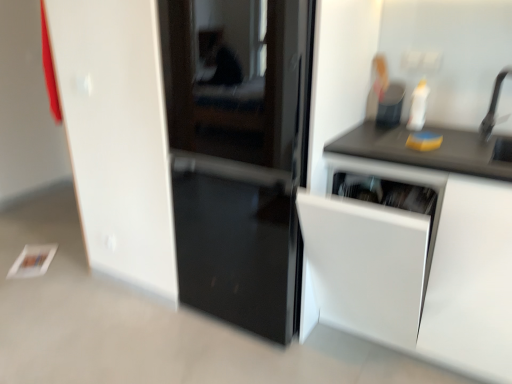
Question: From the image's perspective, is black matte countertop at upper right above or below white matte cabinet at right?

Choices:
 (A) below
 (B) above

Answer: (B)

Question: Relative to white matte cabinet at right, is black matte countertop at upper right in front or behind?

Choices:
 (A) behind
 (B) front

Answer: (A)

Question: Which is farther from the matte black container at upper right?

Choices:
 (A) black matte countertop at upper right
 (B) black matte faucet at upper right
 (C) glossy black door at center
 (D) white matte cabinet at right

Answer: (C)

Question: Considering the real-world distances, which object is farthest from the white matte cabinet at right?

Choices:
 (A) black matte countertop at upper right
 (B) glossy black door at center
 (C) matte black container at upper right
 (D) black matte faucet at upper right

Answer: (C)